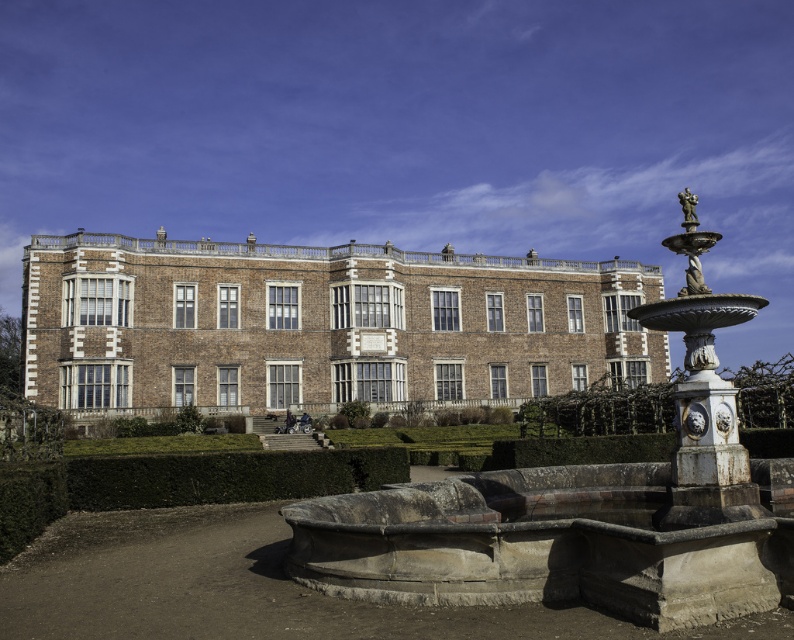
Question: Which object appears closest to the camera in this image?

Choices:
 (A) green leafy hedge at center
 (B) green leafy hedge at lower center

Answer: (A)

Question: Considering the relative positions of green leafy hedge at center and bronze statue at upper right in the image provided, where is green leafy hedge at center located with respect to bronze statue at upper right?

Choices:
 (A) below
 (B) above

Answer: (A)

Question: Which point is closer to the camera taking this photo?

Choices:
 (A) (588, 579)
 (B) (681, 209)

Answer: (A)

Question: Which object appears closest to the camera in this image?

Choices:
 (A) white stone fountain at center
 (B) bronze statue at upper right
 (C) green leafy hedge at lower center

Answer: (A)

Question: Is white stone fountain at center thinner than white marble fountain at right?

Choices:
 (A) yes
 (B) no

Answer: (A)

Question: Does brown brick building at center lie behind green leafy hedge at lower center?

Choices:
 (A) yes
 (B) no

Answer: (A)